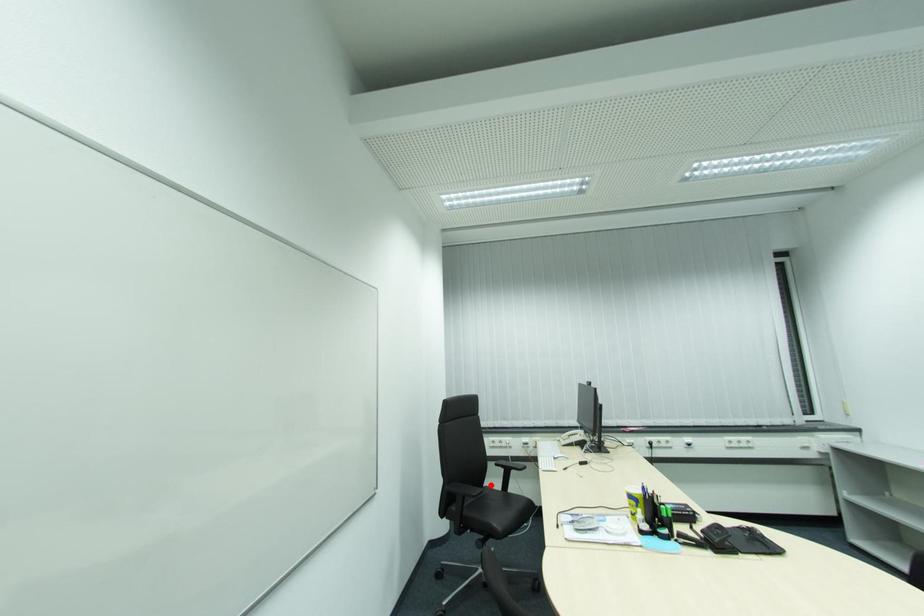
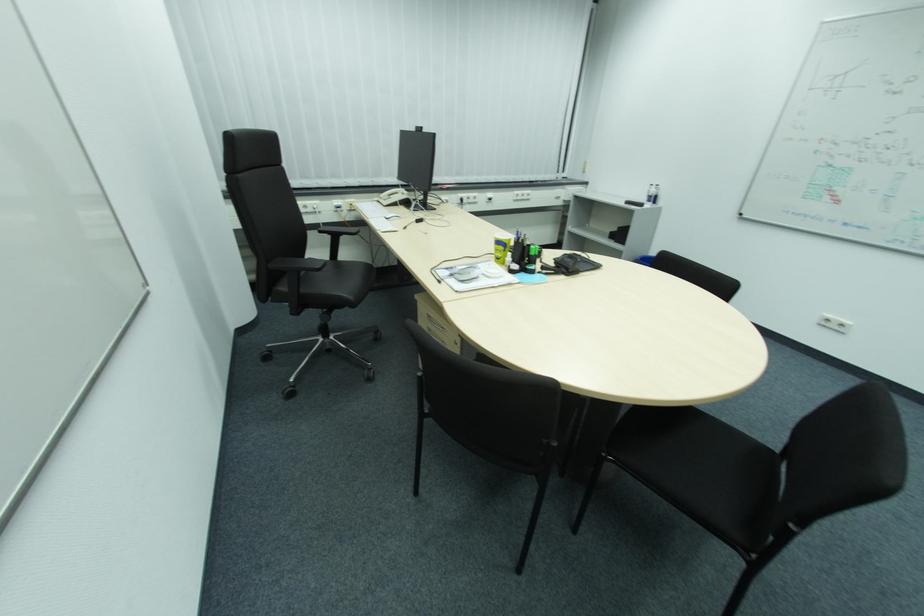
Question: I am providing you with two images of the same scene from different viewpoints. A red point is shown in image1. For the corresponding object point in image2, is it positioned nearer or farther from the camera?

Choices:
 (A) Nearer
 (B) Farther

Answer: (A)